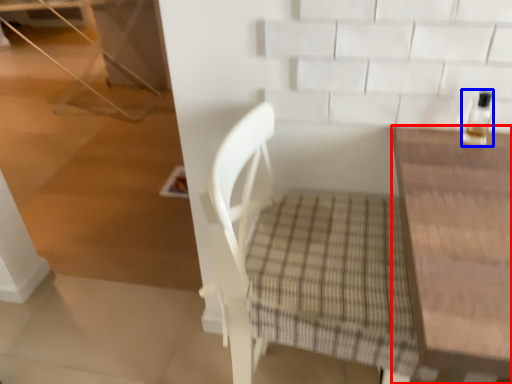
Question: Which object appears closest to the camera in this image, table (highlighted by a red box) or bottle (highlighted by a blue box)?

Choices:
 (A) table
 (B) bottle

Answer: (A)